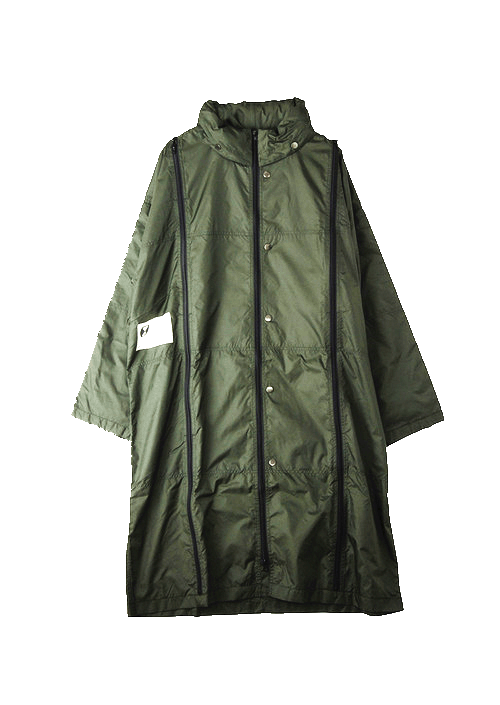
Image resolution: width=500 pixels, height=705 pixels. What are the coordinates of `creases in fabric` in the screenshot? It's located at (359, 441), (159, 295), (212, 555).